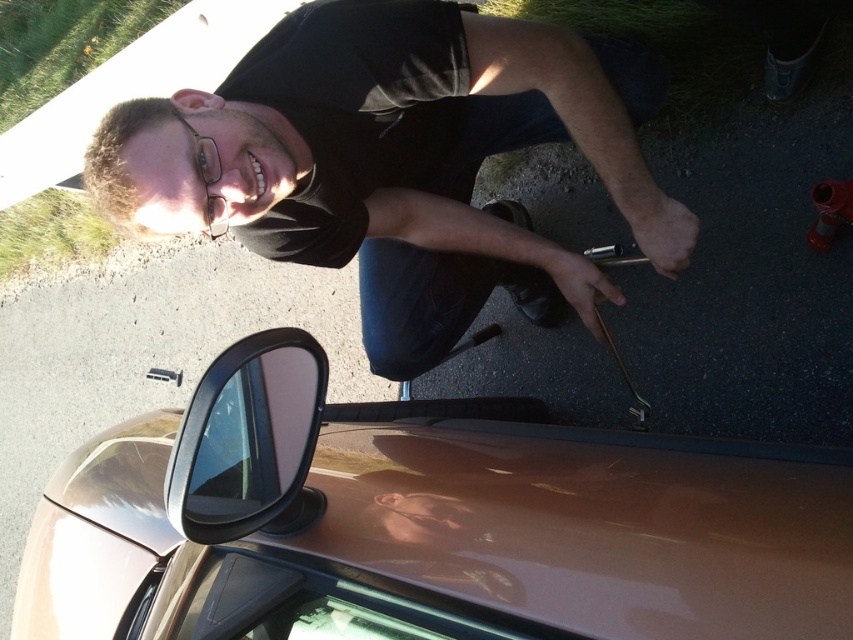
Who is positioned more to the right, black matte shirt at upper center or glossy black side mirror at lower left?

From the viewer's perspective, black matte shirt at upper center appears more on the right side.

Is black matte shirt at upper center to the right of glossy black side mirror at lower left from the viewer's perspective?

Indeed, black matte shirt at upper center is positioned on the right side of glossy black side mirror at lower left.

What do you see at coordinates (397, 161) in the screenshot? This screenshot has height=640, width=853. I see `black matte shirt at upper center` at bounding box center [397, 161].

The height and width of the screenshot is (640, 853). I want to click on black matte shirt at upper center, so click(x=397, y=161).

Who is lower down, glossy metallic car at lower center or glossy black side mirror at lower left?

glossy metallic car at lower center is lower down.

Is glossy metallic car at lower center bigger than glossy black side mirror at lower left?

Correct, glossy metallic car at lower center is larger in size than glossy black side mirror at lower left.

The image size is (853, 640). Identify the location of glossy metallic car at lower center. (476, 532).

Is glossy metallic car at lower center behind black matte shirt at upper center?

No, it is not.

At what (x,y) coordinates should I click in order to perform the action: click on glossy metallic car at lower center. Please return your answer as a coordinate pair (x, y). Image resolution: width=853 pixels, height=640 pixels. Looking at the image, I should click on (476, 532).

This screenshot has height=640, width=853. Identify the location of glossy metallic car at lower center. (476, 532).

Find the location of a particular element. glossy metallic car at lower center is located at coordinates click(x=476, y=532).